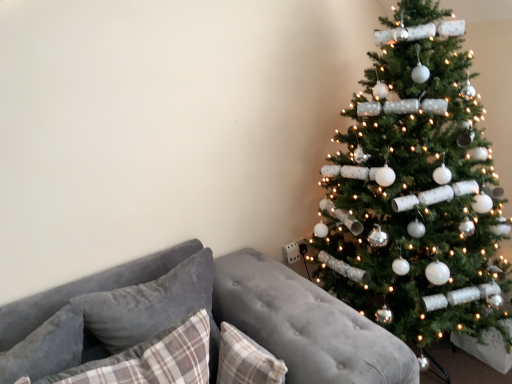
The width and height of the screenshot is (512, 384). Describe the element at coordinates (246, 360) in the screenshot. I see `plaid fabric pillow at center, acting as the fourth pillow starting from the left` at that location.

Where is `gray fabric pillow at lower left, arranged as the 4th pillow when viewed from the right`? gray fabric pillow at lower left, arranged as the 4th pillow when viewed from the right is located at coordinates (46, 348).

This screenshot has width=512, height=384. Find the location of `velvet gray couch at lower left`. velvet gray couch at lower left is located at coordinates (200, 328).

Find the location of a particular element. The width and height of the screenshot is (512, 384). plaid fabric pillow at center, which appears as the 1th pillow when viewed from the right is located at coordinates (246, 360).

Is velvety gray pillow at left, which is the second pillow from left to right, in front of or behind plaid fabric pillow at lower left, which is the third pillow in left-to-right order, in the image?

Clearly, velvety gray pillow at left, which is the second pillow from left to right, is behind plaid fabric pillow at lower left, which is the third pillow in left-to-right order.

From a real-world perspective, is velvety gray pillow at left, the third pillow in the right-to-left sequence, under plaid fabric pillow at lower left, which is the third pillow in left-to-right order?

No, from a real-world perspective, velvety gray pillow at left, the third pillow in the right-to-left sequence, is not below plaid fabric pillow at lower left, which is the third pillow in left-to-right order.

This screenshot has width=512, height=384. I want to click on pillow that is the 3rd one when counting backward from the plaid fabric pillow at lower left, which is the third pillow in left-to-right order, so click(149, 303).

Is velvety gray pillow at left, the third pillow in the right-to-left sequence, positioned with its back to plaid fabric pillow at lower left, which is the third pillow in left-to-right order?

velvety gray pillow at left, the third pillow in the right-to-left sequence, does not have its back to plaid fabric pillow at lower left, which is the third pillow in left-to-right order.

The image size is (512, 384). Find the location of `studio couch in front of the gray fabric pillow at lower left, which is counted as the 1th pillow, starting from the left`. studio couch in front of the gray fabric pillow at lower left, which is counted as the 1th pillow, starting from the left is located at coordinates (200, 328).

Is gray fabric pillow at lower left, arranged as the 4th pillow when viewed from the right, turned away from velvet gray couch at lower left?

Yes, gray fabric pillow at lower left, arranged as the 4th pillow when viewed from the right,'s orientation is away from velvet gray couch at lower left.

From a real-world perspective, which is physically above, gray fabric pillow at lower left, arranged as the 4th pillow when viewed from the right, or velvet gray couch at lower left?

gray fabric pillow at lower left, arranged as the 4th pillow when viewed from the right, from a real-world perspective.

Is velvety gray pillow at left, which is the second pillow from left to right, aimed at shiny silver ornaments at right?

No, velvety gray pillow at left, which is the second pillow from left to right, is not facing towards shiny silver ornaments at right.

Is the surface of velvety gray pillow at left, the third pillow in the right-to-left sequence, in direct contact with shiny silver ornaments at right?

No.

From the image's perspective, which object appears higher, velvety gray pillow at left, which is the second pillow from left to right, or shiny silver ornaments at right?

shiny silver ornaments at right is shown above in the image.

Is shiny silver ornaments at right taller than velvet gray couch at lower left?

Yes.

In the scene shown: Is shiny silver ornaments at right oriented away from velvet gray couch at lower left?

No, velvet gray couch at lower left is not at the back of shiny silver ornaments at right.

From the image's perspective, is shiny silver ornaments at right above velvet gray couch at lower left?

Yes, from the image's perspective, shiny silver ornaments at right is over velvet gray couch at lower left.

Which object is positioned more to the left, shiny silver ornaments at right or velvet gray couch at lower left?

Positioned to the left is velvet gray couch at lower left.

Based on the photo, considering the sizes of velvet gray couch at lower left and plaid fabric pillow at lower left, which is counted as the 2th pillow, starting from the right, in the image, is velvet gray couch at lower left bigger or smaller than plaid fabric pillow at lower left, which is counted as the 2th pillow, starting from the right,?

Clearly, velvet gray couch at lower left is larger in size than plaid fabric pillow at lower left, which is counted as the 2th pillow, starting from the right.

In terms of height, does velvet gray couch at lower left look taller or shorter compared to plaid fabric pillow at lower left, which is counted as the 2th pillow, starting from the right?

Considering their sizes, velvet gray couch at lower left has more height than plaid fabric pillow at lower left, which is counted as the 2th pillow, starting from the right.

Can you confirm if velvet gray couch at lower left is positioned to the left of plaid fabric pillow at lower left, which is the third pillow in left-to-right order?

Incorrect, velvet gray couch at lower left is not on the left side of plaid fabric pillow at lower left, which is the third pillow in left-to-right order.

Looking at this image, from the image's perspective, which one is positioned lower, velvety gray pillow at left, the third pillow in the right-to-left sequence, or plaid fabric pillow at center, acting as the fourth pillow starting from the left?

From the image's view, plaid fabric pillow at center, acting as the fourth pillow starting from the left, is below.

Can you confirm if velvety gray pillow at left, which is the second pillow from left to right, is positioned to the left of plaid fabric pillow at center, which appears as the 1th pillow when viewed from the right?

Correct, you'll find velvety gray pillow at left, which is the second pillow from left to right, to the left of plaid fabric pillow at center, which appears as the 1th pillow when viewed from the right.

How many degrees apart are the facing directions of velvety gray pillow at left, which is the second pillow from left to right, and plaid fabric pillow at center, which appears as the 1th pillow when viewed from the right?

90 degrees separate the facing orientations of velvety gray pillow at left, which is the second pillow from left to right, and plaid fabric pillow at center, which appears as the 1th pillow when viewed from the right.

Measure the distance between velvety gray pillow at left, the third pillow in the right-to-left sequence, and plaid fabric pillow at center, which appears as the 1th pillow when viewed from the right.

The distance of velvety gray pillow at left, the third pillow in the right-to-left sequence, from plaid fabric pillow at center, which appears as the 1th pillow when viewed from the right, is 9.33 inches.

From the velvety gray pillow at left, the third pillow in the right-to-left sequence, count 2nd pillow to the right and point to it. Please provide its 2D coordinates.

[(246, 360)]

Which of these two, plaid fabric pillow at center, which appears as the 1th pillow when viewed from the right, or velvety gray pillow at left, which is the second pillow from left to right, stands taller?

With more height is velvety gray pillow at left, which is the second pillow from left to right.

Does plaid fabric pillow at center, which appears as the 1th pillow when viewed from the right, turn towards velvety gray pillow at left, which is the second pillow from left to right?

No, plaid fabric pillow at center, which appears as the 1th pillow when viewed from the right, is not facing towards velvety gray pillow at left, which is the second pillow from left to right.

From the image's perspective, which one is positioned higher, plaid fabric pillow at center, acting as the fourth pillow starting from the left, or velvety gray pillow at left, which is the second pillow from left to right?

velvety gray pillow at left, which is the second pillow from left to right, appears higher in the image.

Identify the location of the 2nd pillow below the velvety gray pillow at left, the third pillow in the right-to-left sequence (from the image's perspective). This screenshot has width=512, height=384. (152, 359).

Starting from the velvet gray couch at lower left, which pillow is the 2nd one behind? Please provide its 2D coordinates.

[(46, 348)]

When comparing their distances from plaid fabric pillow at center, which appears as the 1th pillow when viewed from the right, does velvet gray couch at lower left or gray fabric pillow at lower left, which is counted as the 1th pillow, starting from the left, seem closer?

Among the two, velvet gray couch at lower left is located nearer to plaid fabric pillow at center, which appears as the 1th pillow when viewed from the right.

When comparing their distances from velvet gray couch at lower left, does shiny silver ornaments at right or plaid fabric pillow at center, acting as the fourth pillow starting from the left, seem closer?

Based on the image, plaid fabric pillow at center, acting as the fourth pillow starting from the left, appears to be nearer to velvet gray couch at lower left.

Considering their positions, is velvety gray pillow at left, which is the second pillow from left to right, positioned closer to plaid fabric pillow at center, which appears as the 1th pillow when viewed from the right, than shiny silver ornaments at right?

velvety gray pillow at left, which is the second pillow from left to right, is positioned closer to the anchor plaid fabric pillow at center, which appears as the 1th pillow when viewed from the right.

From the image, which object appears to be farther from plaid fabric pillow at center, acting as the fourth pillow starting from the left, shiny silver ornaments at right or gray fabric pillow at lower left, which is counted as the 1th pillow, starting from the left?

Among the two, shiny silver ornaments at right is located further to plaid fabric pillow at center, acting as the fourth pillow starting from the left.

From the image, which object appears to be nearer to plaid fabric pillow at center, acting as the fourth pillow starting from the left, plaid fabric pillow at lower left, which is the third pillow in left-to-right order, or velvety gray pillow at left, which is the second pillow from left to right?

Among the two, plaid fabric pillow at lower left, which is the third pillow in left-to-right order, is located nearer to plaid fabric pillow at center, acting as the fourth pillow starting from the left.

Which object lies nearer to the anchor point plaid fabric pillow at lower left, which is the third pillow in left-to-right order, velvet gray couch at lower left or gray fabric pillow at lower left, which is counted as the 1th pillow, starting from the left?

The object closer to plaid fabric pillow at lower left, which is the third pillow in left-to-right order, is velvet gray couch at lower left.

Which object lies further to the anchor point plaid fabric pillow at lower left, which is counted as the 2th pillow, starting from the right, velvety gray pillow at left, which is the second pillow from left to right, or plaid fabric pillow at center, acting as the fourth pillow starting from the left?

plaid fabric pillow at center, acting as the fourth pillow starting from the left, is further to plaid fabric pillow at lower left, which is counted as the 2th pillow, starting from the right.

Considering their positions, is plaid fabric pillow at center, which appears as the 1th pillow when viewed from the right, positioned closer to velvet gray couch at lower left than shiny silver ornaments at right?

Among the two, plaid fabric pillow at center, which appears as the 1th pillow when viewed from the right, is located nearer to velvet gray couch at lower left.

The height and width of the screenshot is (384, 512). Identify the location of studio couch between gray fabric pillow at lower left, which is counted as the 1th pillow, starting from the left, and plaid fabric pillow at center, which appears as the 1th pillow when viewed from the right, in the horizontal direction. (x=200, y=328).

Find the location of a particular element. The height and width of the screenshot is (384, 512). studio couch located between gray fabric pillow at lower left, which is counted as the 1th pillow, starting from the left, and shiny silver ornaments at right in the left-right direction is located at coordinates (200, 328).

Locate an element on the screen. The image size is (512, 384). pillow between plaid fabric pillow at lower left, which is counted as the 2th pillow, starting from the right, and shiny silver ornaments at right from left to right is located at coordinates (246, 360).

I want to click on pillow situated between velvet gray couch at lower left and shiny silver ornaments at right from left to right, so click(246, 360).